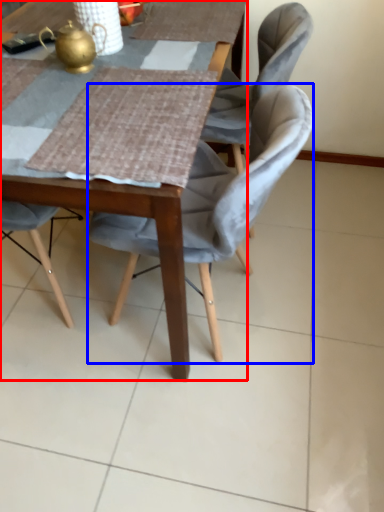
Question: Among these objects, which one is nearest to the camera, table (highlighted by a red box) or chair (highlighted by a blue box)?

Choices:
 (A) table
 (B) chair

Answer: (A)